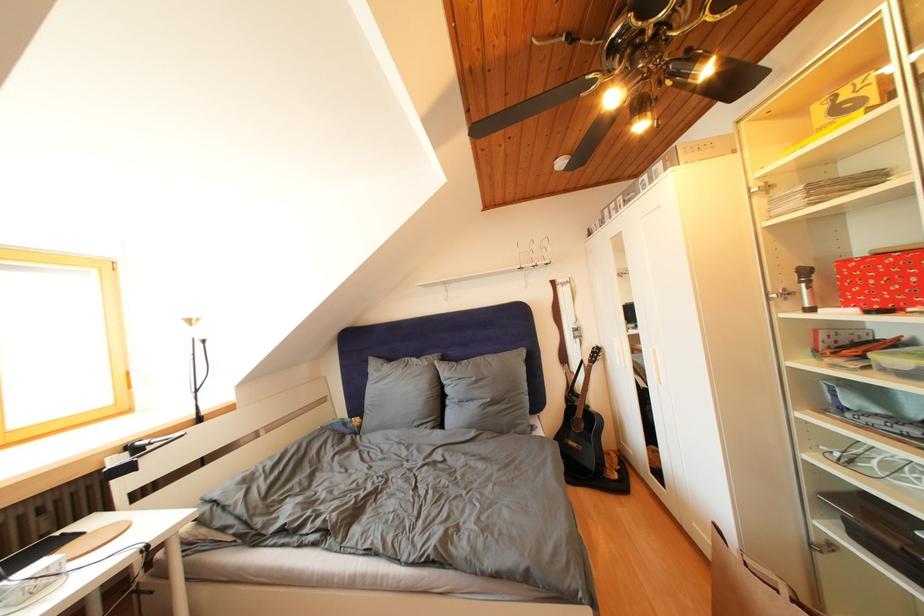
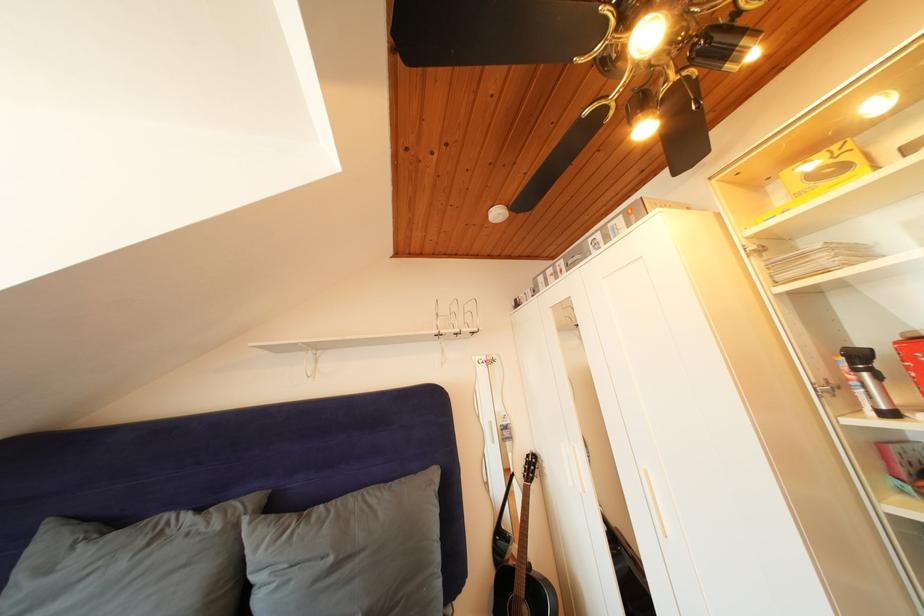
Locate, in the second image, the point that corresponds to point 433,369 in the first image.

(225, 531)